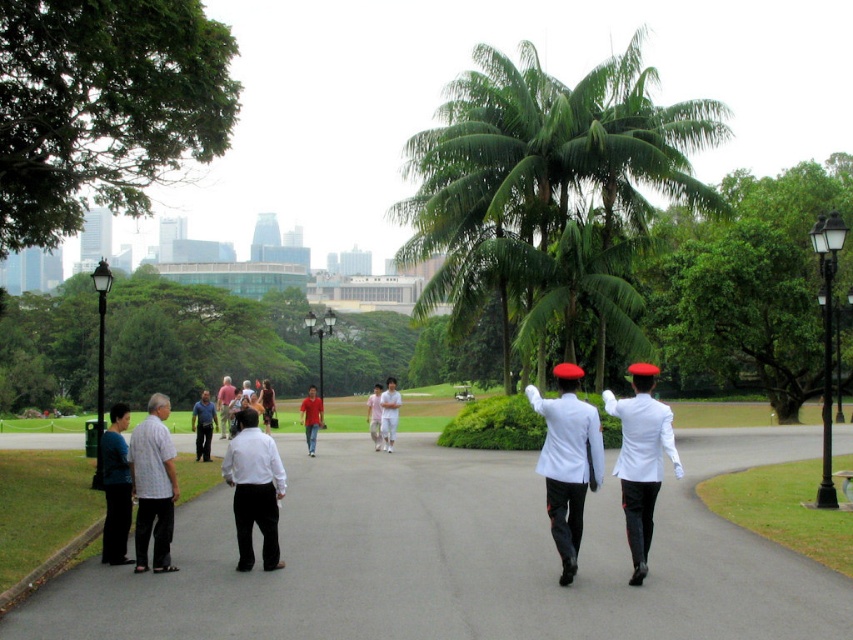
Can you confirm if gray asphalt pavement at center is shorter than matte black pants at left?

Yes, gray asphalt pavement at center is shorter than matte black pants at left.

Which is more to the right, gray asphalt pavement at center or matte black pants at left?

gray asphalt pavement at center is more to the right.

The image size is (853, 640). Describe the element at coordinates (460, 557) in the screenshot. I see `gray asphalt pavement at center` at that location.

Locate an element on the screen. This screenshot has width=853, height=640. gray asphalt pavement at center is located at coordinates (460, 557).

Is white matte jacket at center thinner than white cotton shirt at center?

In fact, white matte jacket at center might be wider than white cotton shirt at center.

Is white matte jacket at center wider than white cotton shirt at center?

Yes.

Who is more distant from viewer, (651, 404) or (376, 433)?

Positioned behind is point (376, 433).

Identify the location of white matte jacket at center. This screenshot has width=853, height=640. [641, 464].

Is matte white shirt at center below matte red shirt at center?

No.

Does point (386, 406) lie in front of point (309, 435)?

No, it is not.

Which is in front, point (386, 435) or point (320, 403)?

Point (320, 403) is in front.

Where is `matte white shirt at center`? The width and height of the screenshot is (853, 640). matte white shirt at center is located at coordinates pyautogui.click(x=389, y=413).